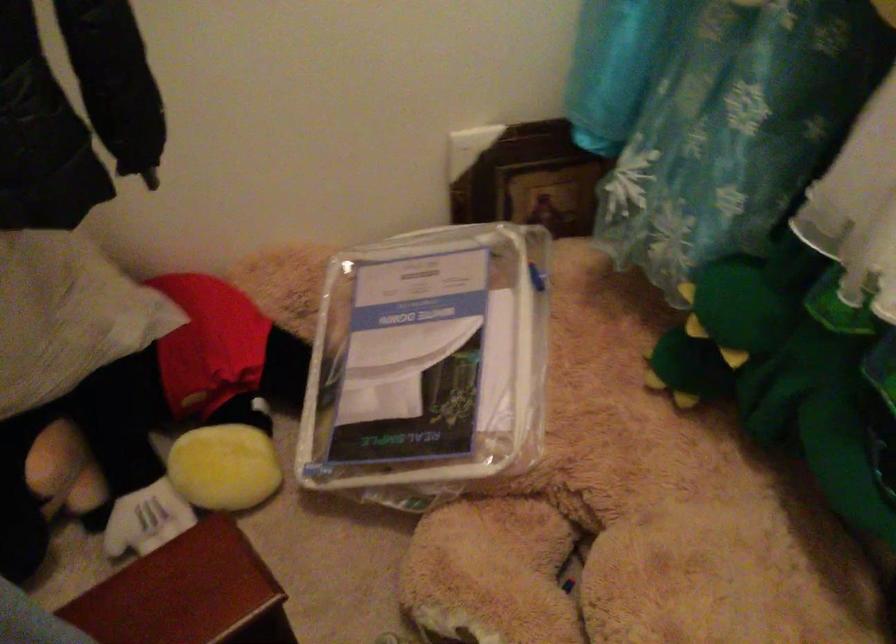
The image size is (896, 644). What do you see at coordinates (536, 277) in the screenshot?
I see `the blue zipper pull` at bounding box center [536, 277].